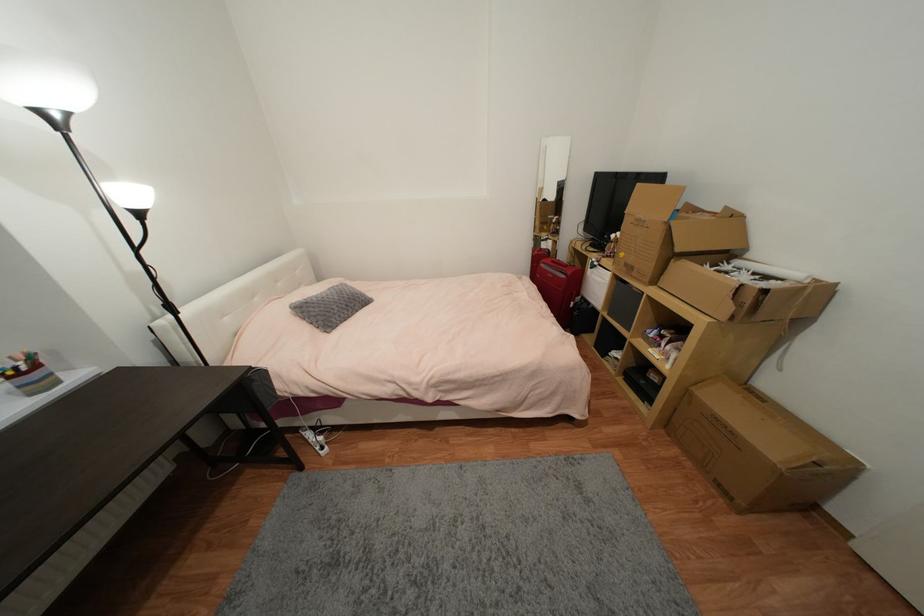
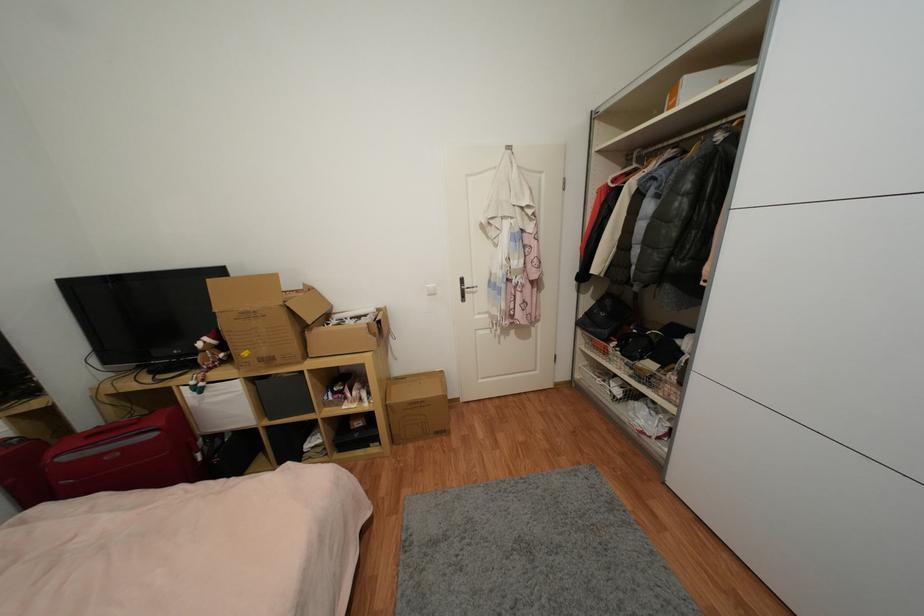
Locate, in the second image, the point that corresponds to (671,426) in the first image.

(397, 440)